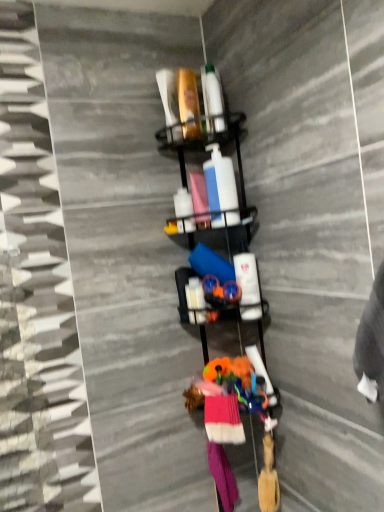
The image size is (384, 512). What do you see at coordinates (199, 200) in the screenshot?
I see `pink fabric at center` at bounding box center [199, 200].

This screenshot has height=512, width=384. I want to click on metallic black shelf at center, so click(x=200, y=139).

What do you see at coordinates (223, 419) in the screenshot? I see `knitted wool socks at center, which is the 1th clothing from front to back` at bounding box center [223, 419].

Locate an element on the screen. Image resolution: width=384 pixels, height=512 pixels. pink fabric at center is located at coordinates (199, 200).

Can metallic black shelf at center be found inside knitted wool socks at center, positioned as the 2th clothing in bottom-to-top order?

No, metallic black shelf at center is not inside knitted wool socks at center, positioned as the 2th clothing in bottom-to-top order.

Looking at their sizes, would you say knitted wool socks at center, positioned as the 2th clothing in bottom-to-top order, is wider or thinner than metallic black shelf at center?

In the image, knitted wool socks at center, positioned as the 2th clothing in bottom-to-top order, appears to be more narrow than metallic black shelf at center.

Locate an element on the screen. This screenshot has height=512, width=384. shelf on the left of knitted wool socks at center, the 2th clothing positioned from the back is located at coordinates (200, 139).

In the image, is knitted wool socks at center, which is the 1th clothing from front to back, positioned in front of or behind metallic black shelf at center?

knitted wool socks at center, which is the 1th clothing from front to back, is behind metallic black shelf at center.

How much distance is there between knitted wool socks at center, which is the 1th clothing from front to back, and pink fabric socks at lower center, acting as the 1th clothing starting from the bottom?

6.25 inches.

Does knitted wool socks at center, positioned as the 2th clothing in bottom-to-top order, have a smaller size compared to pink fabric socks at lower center, acting as the 1th clothing starting from the bottom?

Indeed, knitted wool socks at center, positioned as the 2th clothing in bottom-to-top order, has a smaller size compared to pink fabric socks at lower center, acting as the 1th clothing starting from the bottom.

From the image's perspective, which is above, knitted wool socks at center, the 2th clothing positioned from the back, or pink fabric socks at lower center, the 2th clothing viewed from the top?

knitted wool socks at center, the 2th clothing positioned from the back, is shown above in the image.

Is knitted wool socks at center, which is the 1th clothing from front to back, closer to camera compared to pink fabric socks at lower center, the 2th clothing viewed from the top?

That is True.

Which object is positioned more to the left, metallic black shelf at center or pink fabric socks at lower center, acting as the 1th clothing starting from the bottom?

From the viewer's perspective, metallic black shelf at center appears more on the left side.

Is metallic black shelf at center further to the viewer compared to pink fabric socks at lower center, acting as the 1th clothing starting from the bottom?

No, metallic black shelf at center is closer to the camera.

From the picture: Is metallic black shelf at center oriented away from pink fabric socks at lower center, the 2th clothing viewed from the top?

metallic black shelf at center does not have its back to pink fabric socks at lower center, the 2th clothing viewed from the top.

Where is `shelf in front of the pink fabric socks at lower center, which is counted as the first clothing, starting from the back`? The image size is (384, 512). shelf in front of the pink fabric socks at lower center, which is counted as the first clothing, starting from the back is located at coordinates (200, 139).

From the image's perspective, which object appears higher, pink fabric at center or knitted wool socks at center, which is the 1th clothing from front to back?

pink fabric at center appears higher in the image.

Between pink fabric at center and knitted wool socks at center, which is the 1th clothing from front to back, which one is positioned in front?

knitted wool socks at center, which is the 1th clothing from front to back, is in front.

Between pink fabric at center and knitted wool socks at center, positioned as the 2th clothing in bottom-to-top order, which one has less height?

With less height is knitted wool socks at center, positioned as the 2th clothing in bottom-to-top order.

From the image's perspective, who appears lower, pink fabric at center or metallic black shelf at center?

metallic black shelf at center, from the image's perspective.

Considering the positions of objects pink fabric at center and metallic black shelf at center in the image provided, who is more to the right, pink fabric at center or metallic black shelf at center?

metallic black shelf at center is more to the right.

From a real-world perspective, relative to metallic black shelf at center, is pink fabric at center vertically above or below?

pink fabric at center is situated higher than metallic black shelf at center in the real world.

Is the position of pink fabric at center less distant than that of metallic black shelf at center?

No, it is behind metallic black shelf at center.

Between pink fabric socks at lower center, the second clothing from the front, and pink fabric at center, which one has smaller width?

Thinner between the two is pink fabric at center.

From a real-world perspective, who is located lower, pink fabric socks at lower center, the 2th clothing viewed from the top, or pink fabric at center?

pink fabric socks at lower center, the 2th clothing viewed from the top.

From the image's perspective, which object appears higher, pink fabric socks at lower center, acting as the 1th clothing starting from the bottom, or pink fabric at center?

pink fabric at center, from the image's perspective.

In terms of size, does pink fabric socks at lower center, acting as the 1th clothing starting from the bottom, appear bigger or smaller than pink fabric at center?

pink fabric socks at lower center, acting as the 1th clothing starting from the bottom, is bigger than pink fabric at center.

Based on the photo, is metallic black shelf at center a part of pink fabric socks at lower center, acting as the 1th clothing starting from the bottom?

No, pink fabric socks at lower center, acting as the 1th clothing starting from the bottom, does not contain metallic black shelf at center.

Looking at this image, considering the relative sizes of pink fabric socks at lower center, the 2th clothing viewed from the top, and metallic black shelf at center in the image provided, is pink fabric socks at lower center, the 2th clothing viewed from the top, bigger than metallic black shelf at center?

Incorrect, pink fabric socks at lower center, the 2th clothing viewed from the top, is not larger than metallic black shelf at center.

Are pink fabric socks at lower center, the 2th clothing viewed from the top, and metallic black shelf at center beside each other?

No, pink fabric socks at lower center, the 2th clothing viewed from the top, is not next to metallic black shelf at center.

Which object is thinner, pink fabric socks at lower center, which is counted as the first clothing, starting from the back, or metallic black shelf at center?

With smaller width is pink fabric socks at lower center, which is counted as the first clothing, starting from the back.

Locate an element on the screen. shelf that is in front of the knitted wool socks at center, positioned as the 2th clothing in bottom-to-top order is located at coordinates (200, 139).

Image resolution: width=384 pixels, height=512 pixels. What are the coordinates of `clothing that appears below the knitted wool socks at center, positioned as the 2th clothing in bottom-to-top order (from a real-world perspective)` in the screenshot? It's located at (222, 476).

Looking at the image, which one is located closer to knitted wool socks at center, which is the 1th clothing from front to back, pink fabric at center or metallic black shelf at center?

Based on the image, metallic black shelf at center appears to be nearer to knitted wool socks at center, which is the 1th clothing from front to back.

When comparing their distances from pink fabric at center, does pink fabric socks at lower center, the second clothing from the front, or knitted wool socks at center, placed as the first clothing when sorted from top to bottom, seem closer?

The object closer to pink fabric at center is knitted wool socks at center, placed as the first clothing when sorted from top to bottom.

Looking at the image, which one is located further to pink fabric at center, pink fabric socks at lower center, the 2th clothing viewed from the top, or metallic black shelf at center?

pink fabric socks at lower center, the 2th clothing viewed from the top, is further to pink fabric at center.

When comparing their distances from pink fabric socks at lower center, which is counted as the first clothing, starting from the back, does pink fabric at center or metallic black shelf at center seem further?

pink fabric at center.

Looking at the image, which one is located closer to pink fabric at center, knitted wool socks at center, which is the 1th clothing from front to back, or metallic black shelf at center?

Based on the image, metallic black shelf at center appears to be nearer to pink fabric at center.

Considering their positions, is pink fabric at center positioned closer to metallic black shelf at center than pink fabric socks at lower center, which is counted as the first clothing, starting from the back?

The object closer to metallic black shelf at center is pink fabric at center.

Looking at the image, which one is located closer to pink fabric socks at lower center, the 2th clothing viewed from the top, metallic black shelf at center or knitted wool socks at center, placed as the first clothing when sorted from top to bottom?

The object closer to pink fabric socks at lower center, the 2th clothing viewed from the top, is knitted wool socks at center, placed as the first clothing when sorted from top to bottom.

Based on their spatial positions, is metallic black shelf at center or pink fabric at center closer to knitted wool socks at center, positioned as the 2th clothing in bottom-to-top order?

The object closer to knitted wool socks at center, positioned as the 2th clothing in bottom-to-top order, is metallic black shelf at center.

This screenshot has height=512, width=384. I want to click on shelf between pink fabric at center and pink fabric socks at lower center, acting as the 1th clothing starting from the bottom, vertically, so click(x=200, y=139).

Find the location of `shelf between pink fabric at center and knitted wool socks at center, placed as the first clothing when sorted from top to bottom, vertically`. shelf between pink fabric at center and knitted wool socks at center, placed as the first clothing when sorted from top to bottom, vertically is located at coordinates (200, 139).

Where is `clothing that lies between metallic black shelf at center and pink fabric socks at lower center, the second clothing from the front, from top to bottom`? The width and height of the screenshot is (384, 512). clothing that lies between metallic black shelf at center and pink fabric socks at lower center, the second clothing from the front, from top to bottom is located at coordinates (223, 419).

Find the location of a particular element. This screenshot has height=512, width=384. clothing between pink fabric at center and pink fabric socks at lower center, the second clothing from the front, in the vertical direction is located at coordinates (223, 419).